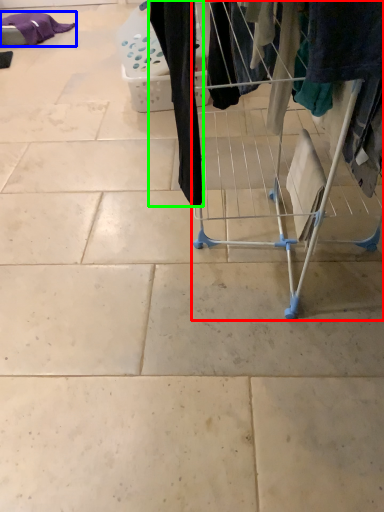
Question: Which object is positioned closest to furniture (highlighted by a red box)? Select from clothing (highlighted by a blue box) and clothing (highlighted by a green box).

Choices:
 (A) clothing
 (B) clothing

Answer: (B)